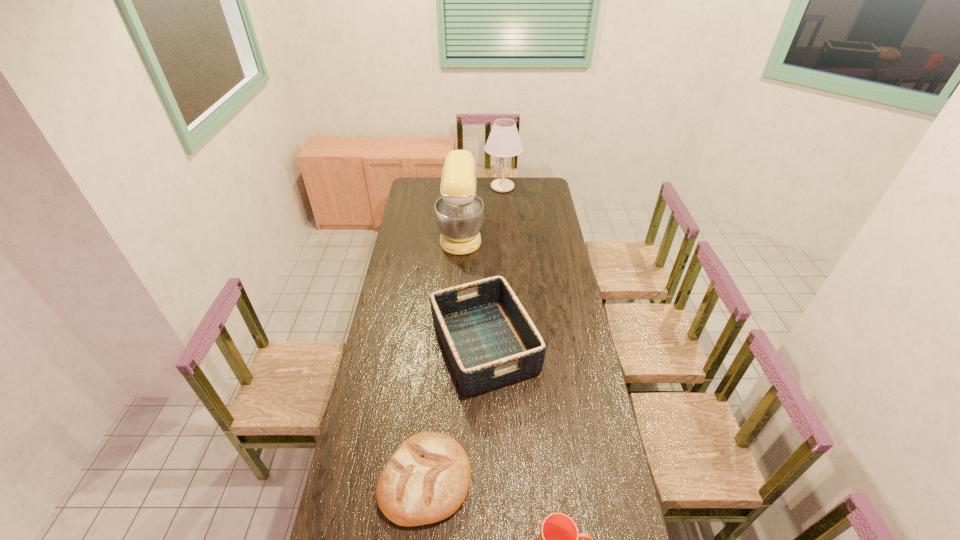
At what (x,y) coordinates should I click in order to perform the action: click on the farthest object. Please return your answer as a coordinate pair (x, y). Image resolution: width=960 pixels, height=540 pixels. Looking at the image, I should click on (504, 141).

In order to click on mixer in this screenshot , I will do `click(459, 213)`.

Locate an element on the screen. This screenshot has height=540, width=960. the third tallest object is located at coordinates (490, 341).

You are a GUI agent. You are given a task and a screenshot of the screen. Output one action in this format:
    pyautogui.click(x=<x>, y=<y>)
    Task: Click on the third nearest object
    The height and width of the screenshot is (540, 960).
    Given the screenshot: What is the action you would take?
    pyautogui.click(x=490, y=341)

What are the coordinates of `the second nearest object` in the screenshot? It's located at (426, 480).

Image resolution: width=960 pixels, height=540 pixels. Find the location of `the shortest object`. the shortest object is located at coordinates (426, 480).

Identify the location of vacant space situated on the left of the farthest object. (460, 187).

At what (x,y) coordinates should I click in order to perform the action: click on free space located 0.120m on the side of the second farthest object with the control knob. Please return your answer as a coordinate pair (x, y). The height and width of the screenshot is (540, 960). Looking at the image, I should click on (504, 233).

Locate an element on the screen. This screenshot has height=540, width=960. vacant region located on the front of the third tallest object is located at coordinates (485, 416).

Where is `free location located 0.060m on the right of the shortest object`? free location located 0.060m on the right of the shortest object is located at coordinates (489, 478).